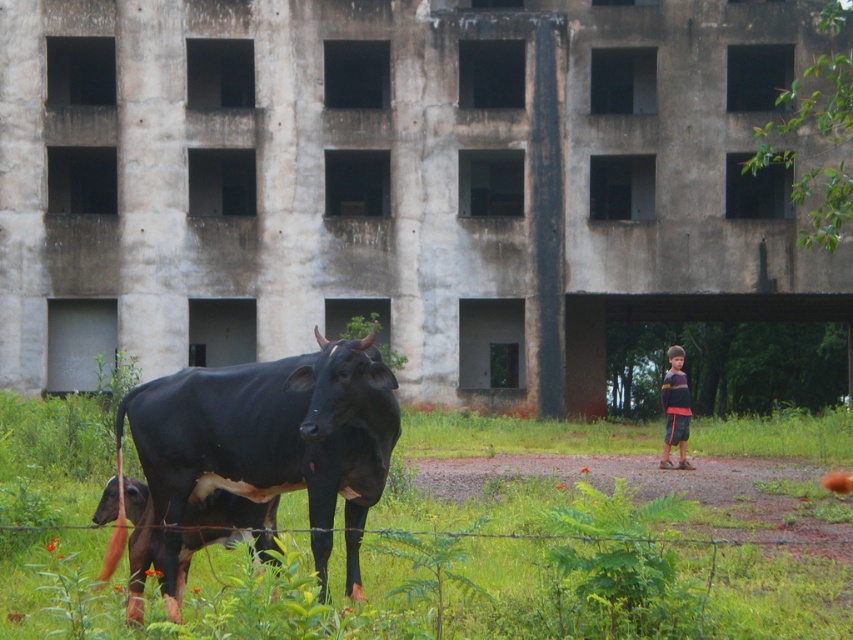
You are a photographer standing in the field. You want to take a picture of the black glossy bull at center but need to avoid having the green grass at lower left in the foreground. Which direction should you move to ensure the bull is centered and the grass is out of frame?

The green grass at lower left is in front of the black glossy bull at center. To avoid the grass in the foreground, move to the right side of the bull so the grass is no longer blocking the view.

You are standing in the field where the cow and calf are grazing. You notice a specific point marked at coordinates (486, 568). What is located at that point?

The point at coordinates (486, 568) corresponds to green grass at lower left.